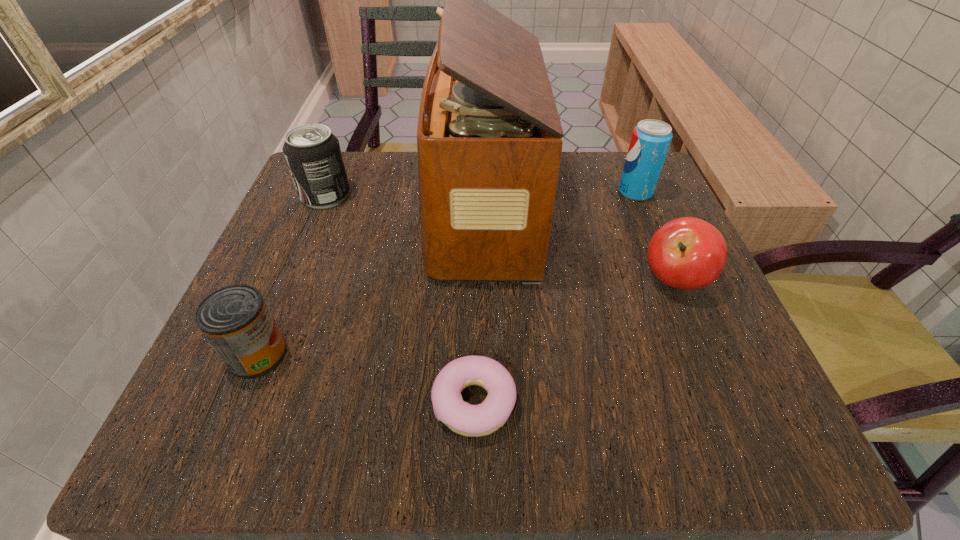
The height and width of the screenshot is (540, 960). In order to click on object that is at the far left corner in this screenshot , I will do `click(313, 155)`.

Where is `object at the far right corner`? This screenshot has height=540, width=960. object at the far right corner is located at coordinates (650, 141).

Locate an element on the screen. The image size is (960, 540). vacant area at the far edge of the desktop is located at coordinates (396, 174).

Where is `vacant space at the near edge of the desktop`? vacant space at the near edge of the desktop is located at coordinates (387, 399).

The width and height of the screenshot is (960, 540). I want to click on vacant point at the left edge, so click(x=327, y=246).

The width and height of the screenshot is (960, 540). In the image, there is a desktop. Identify the location of vacant region at the right edge. (722, 310).

Find the location of `vacant space at the far left corner of the desktop`. vacant space at the far left corner of the desktop is located at coordinates (355, 209).

Identify the location of vacant space at the near left corner. The height and width of the screenshot is (540, 960). point(296,437).

At what (x,y) coordinates should I click in order to perform the action: click on vacant space at the far right corner of the desktop. Please return your answer as a coordinate pair (x, y). Looking at the image, I should click on (638, 203).

The height and width of the screenshot is (540, 960). Identify the location of vacant space at the near right corner of the desktop. (710, 449).